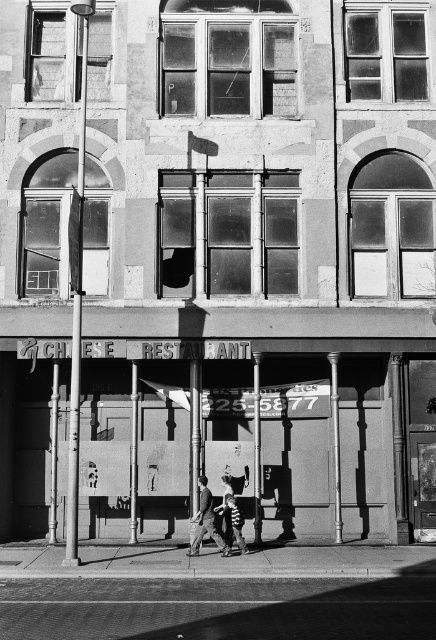
Question: Is smooth asphalt road at bottom smaller than smooth concrete sidewalk at lower center?

Choices:
 (A) yes
 (B) no

Answer: (B)

Question: Among these objects, which one is nearest to the camera?

Choices:
 (A) smooth concrete storefront at center
 (B) smooth concrete sidewalk at lower center

Answer: (B)

Question: From the image, what is the correct spatial relationship of smooth concrete storefront at center in relation to smooth asphalt road at bottom?

Choices:
 (A) right
 (B) left

Answer: (B)

Question: Which point is farther to the camera?

Choices:
 (A) smooth concrete storefront at center
 (B) smooth concrete sidewalk at lower center
 (C) smooth asphalt road at bottom

Answer: (A)

Question: Which point is closer to the camera taking this photo?

Choices:
 (A) (280, 577)
 (B) (205, 477)

Answer: (A)

Question: Is smooth concrete storefront at center to the left of dark gray fabric pants at center from the viewer's perspective?

Choices:
 (A) yes
 (B) no

Answer: (B)